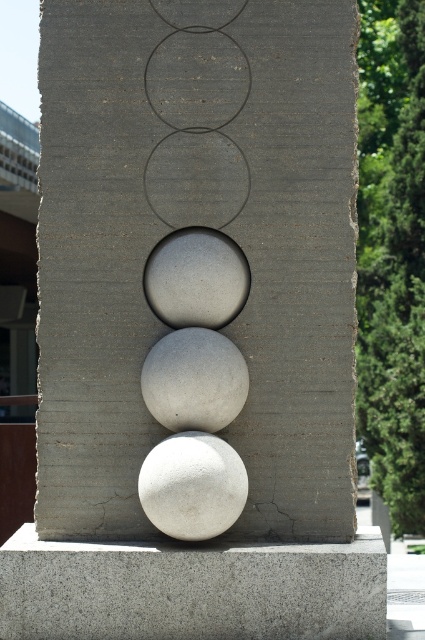
Is point (158, 492) positioned in front of point (158, 392)?

That is True.

What do you see at coordinates (192, 484) in the screenshot? This screenshot has width=425, height=640. I see `white matte sphere at center` at bounding box center [192, 484].

The width and height of the screenshot is (425, 640). I want to click on white matte sphere at center, so click(192, 484).

Identify the location of white matte sphere at center. (192, 484).

Does point (141, 170) lie in front of point (110, 612)?

No, it is not.

Identify the location of smooth concrete spheres at center. (197, 225).

Is point (59, 60) behind point (175, 630)?

Yes, point (59, 60) is behind point (175, 630).

Identify the location of smooth concrete spheres at center. (197, 225).

Is white matte sphere at center above smooth concrete circle at upper center?

No.

Between white matte sphere at center and smooth concrete circle at upper center, which one appears on the right side from the viewer's perspective?

Positioned to the right is smooth concrete circle at upper center.

Between point (218, 474) and point (201, 24), which one is positioned behind?

Point (201, 24)

Image resolution: width=425 pixels, height=640 pixels. What are the coordinates of `white matte sphere at center` in the screenshot? It's located at coord(192,484).